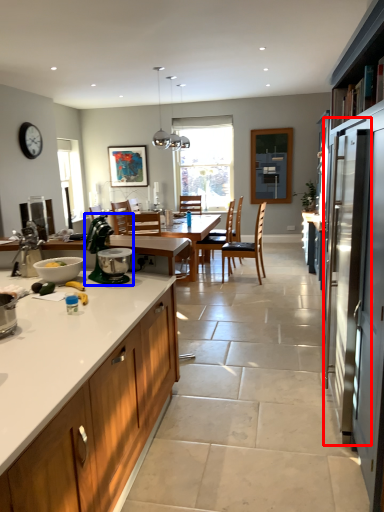
Question: Which object is closer to the camera taking this photo, screen door (highlighted by a red box) or appliance (highlighted by a blue box)?

Choices:
 (A) screen door
 (B) appliance

Answer: (A)